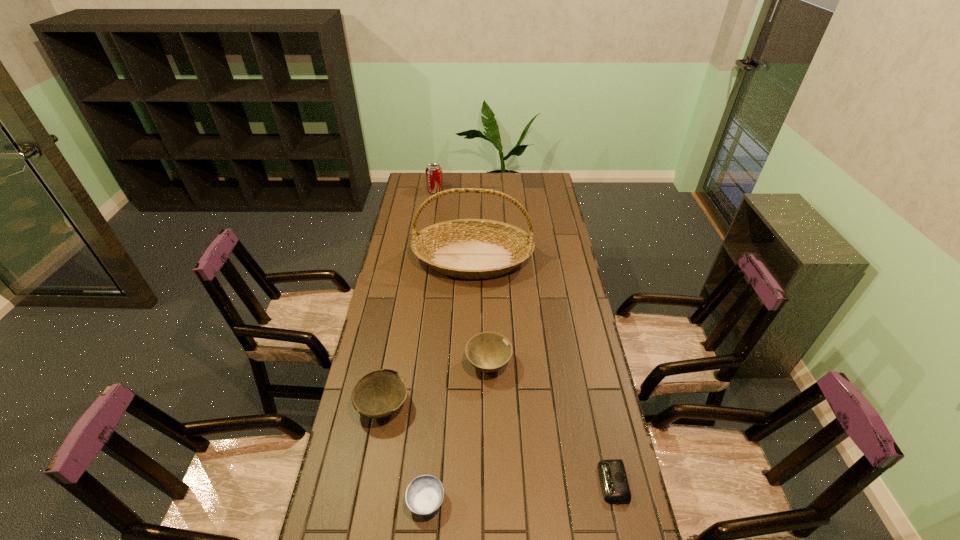
Find the location of `vacant space situated 0.140m on the back of the farthest object`. vacant space situated 0.140m on the back of the farthest object is located at coordinates pyautogui.click(x=438, y=173).

The width and height of the screenshot is (960, 540). I want to click on vacant space positioned on the back of the right bowl, so click(488, 291).

I want to click on vacant position located 0.220m on the right of the left bowl, so click(479, 406).

Locate an element on the screen. The image size is (960, 540). vacant space located 0.370m on the right of the ashtray is located at coordinates (584, 501).

I want to click on blank area located 0.360m on the display of the alarm clock, so click(x=469, y=483).

This screenshot has height=540, width=960. In order to click on vacant area situated on the display of the alarm clock in this screenshot , I will do `click(495, 483)`.

This screenshot has height=540, width=960. Find the location of `free space located on the display of the alarm clock`. free space located on the display of the alarm clock is located at coordinates (575, 483).

The width and height of the screenshot is (960, 540). Find the location of `object situated at the far edge`. object situated at the far edge is located at coordinates (434, 179).

At what (x,y) coordinates should I click in order to perform the action: click on basket present at the left edge. Please return your answer as a coordinate pair (x, y). The width and height of the screenshot is (960, 540). Looking at the image, I should click on (463, 248).

Identify the location of soda can situated at the left edge. (434, 179).